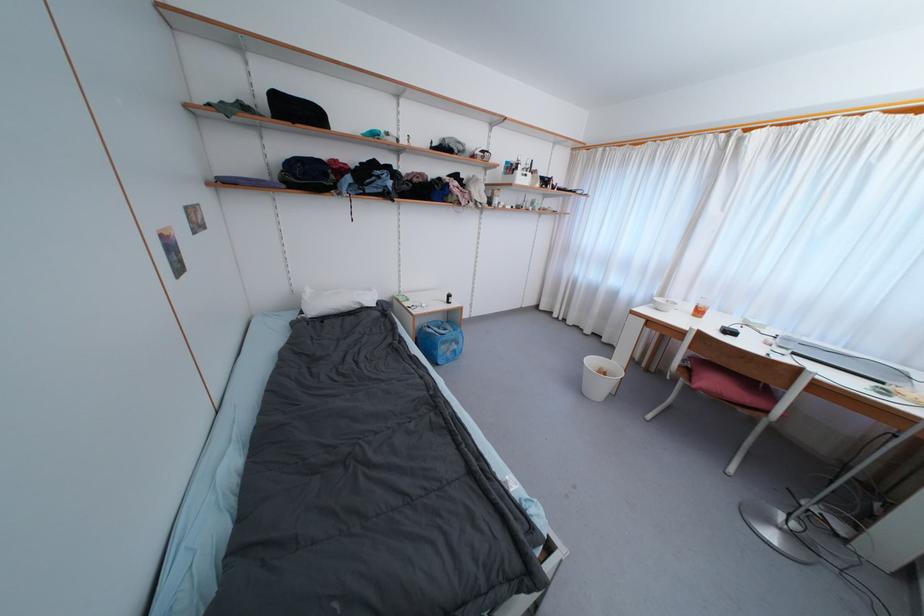
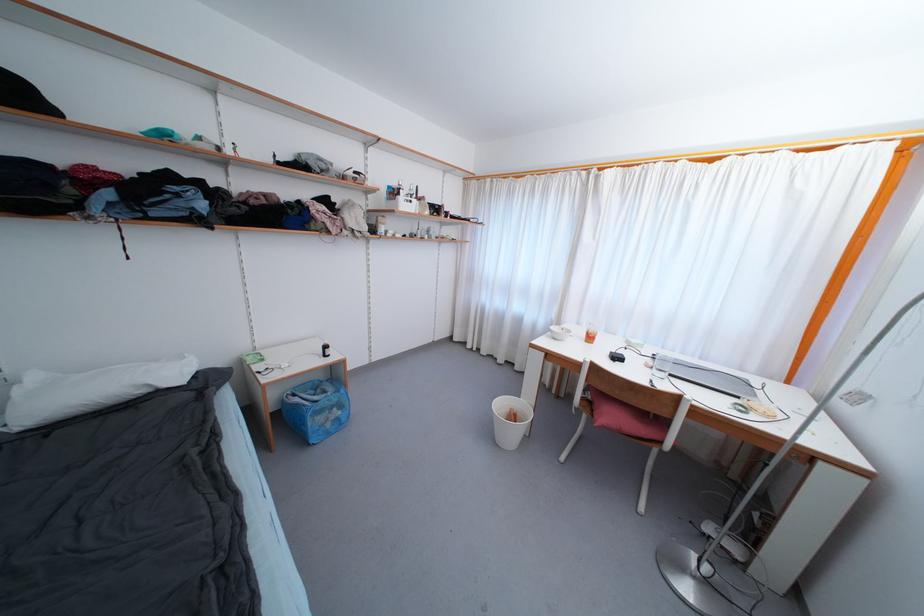
The point at (716, 385) is marked in the first image. Where is the corresponding point in the second image?

(615, 419)